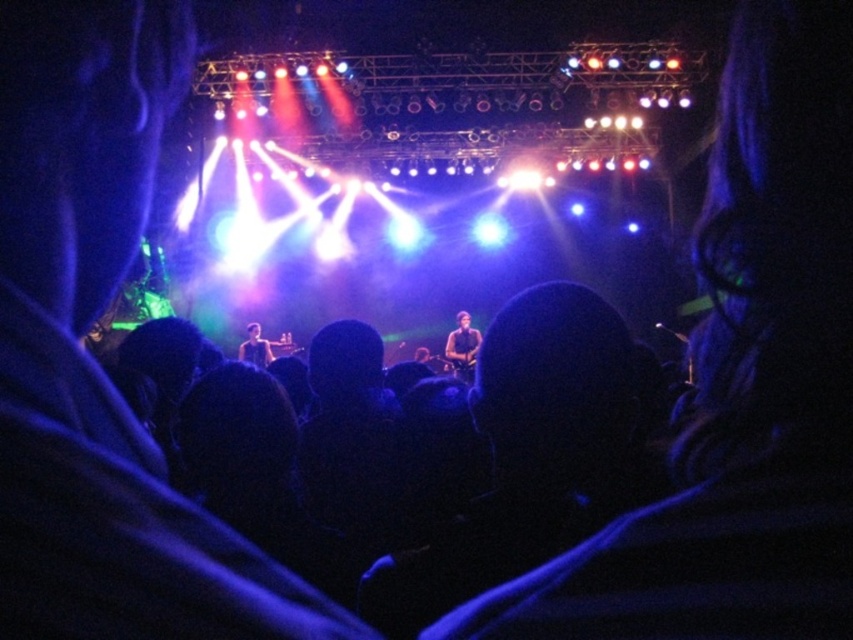
You are a photographer at the concert. You want to capture the shiny black guitar at center in your photo. The camera you are using has a focus point at coordinate point (462, 346). Is this focus point correctly positioned to capture the guitar?

Yes, the focus point at coordinate point (462, 346) is correctly positioned because it corresponds to the shiny black guitar at center.

You are a photographer standing at the front row of the concert. You want to take a closeup photo of the shiny black guitar at center. Based on its 2D location coordinates, where should you aim your camera?

The shiny black guitar at center is located at the 2D coordinates point (462, 346), so you should aim your camera at that specific point to capture it in the closeup photo.

You are a photographer at the concert and want to capture a closeup shot of the smooth skin face at center without the shiny black guitar at center appearing in the frame. Is this possible with your current camera lens that has a 50mm focal length?

The shiny black guitar at center is 10.00 feet from the smooth skin face at center. With a 50mm focal length, it might be challenging to avoid the guitar in the frame since they are relatively close. Consider moving closer or using a longer focal length for better isolation.